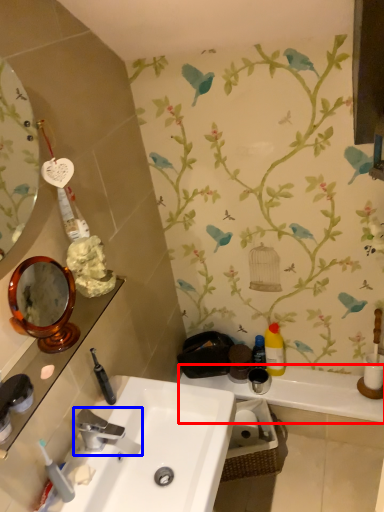
Question: Which point is closer to the camera, counter top (highlighted by a red box) or tap (highlighted by a blue box)?

Choices:
 (A) counter top
 (B) tap

Answer: (B)